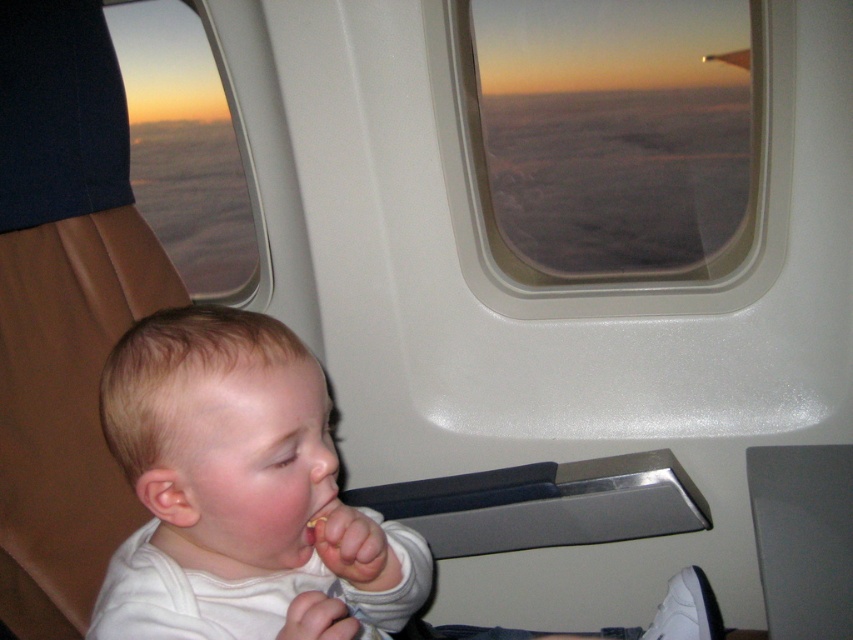
Question: Considering the real-world distances, which object is closest to the smooth yellowish flesh at mouth center?

Choices:
 (A) transparent glass airplane window at upper center
 (B) matte glass airplane window at upper left
 (C) white matte baby at center

Answer: (C)

Question: Is white matte baby at center to the right of transparent glass airplane window at upper center from the viewer's perspective?

Choices:
 (A) no
 (B) yes

Answer: (A)

Question: Where is transparent glass airplane window at upper center located in relation to smooth yellowish flesh at mouth center in the image?

Choices:
 (A) below
 (B) above

Answer: (B)

Question: Which point appears closest to the camera in this image?

Choices:
 (A) (351, 609)
 (B) (334, 500)
 (C) (488, 282)
 (D) (233, 241)

Answer: (B)

Question: Which is nearer to the white matte baby at center?

Choices:
 (A) transparent glass airplane window at upper center
 (B) matte glass airplane window at upper left

Answer: (A)

Question: Is matte glass airplane window at upper left below smooth yellowish flesh at mouth center?

Choices:
 (A) no
 (B) yes

Answer: (A)